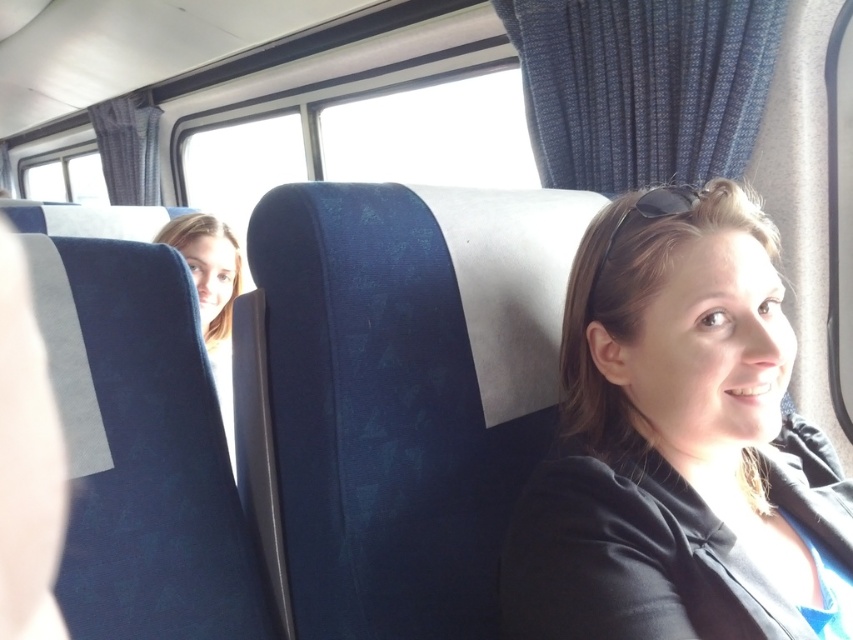
Question: Where is matte black jacket at center located in relation to blonde hair at upper left in the image?

Choices:
 (A) above
 (B) below

Answer: (B)

Question: Which of the following is the farthest from the observer?

Choices:
 (A) matte black jacket at center
 (B) sunglasses at center
 (C) blonde hair at upper left

Answer: (C)

Question: Which point is farther from the camera taking this photo?

Choices:
 (A) (228, 390)
 (B) (671, 195)

Answer: (A)

Question: Estimate the real-world distances between objects in this image. Which object is closer to the sunglasses at center?

Choices:
 (A) matte black jacket at center
 (B) blonde hair at upper left

Answer: (A)

Question: In this image, where is matte black jacket at center located relative to blonde hair at upper left?

Choices:
 (A) below
 (B) above

Answer: (A)

Question: Does blonde hair at upper left have a larger size compared to sunglasses at center?

Choices:
 (A) yes
 (B) no

Answer: (A)